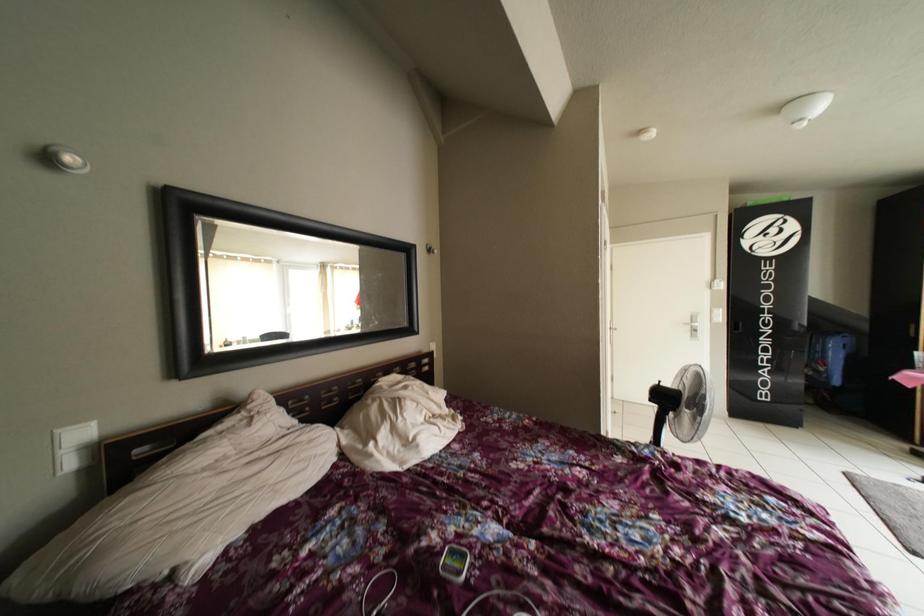
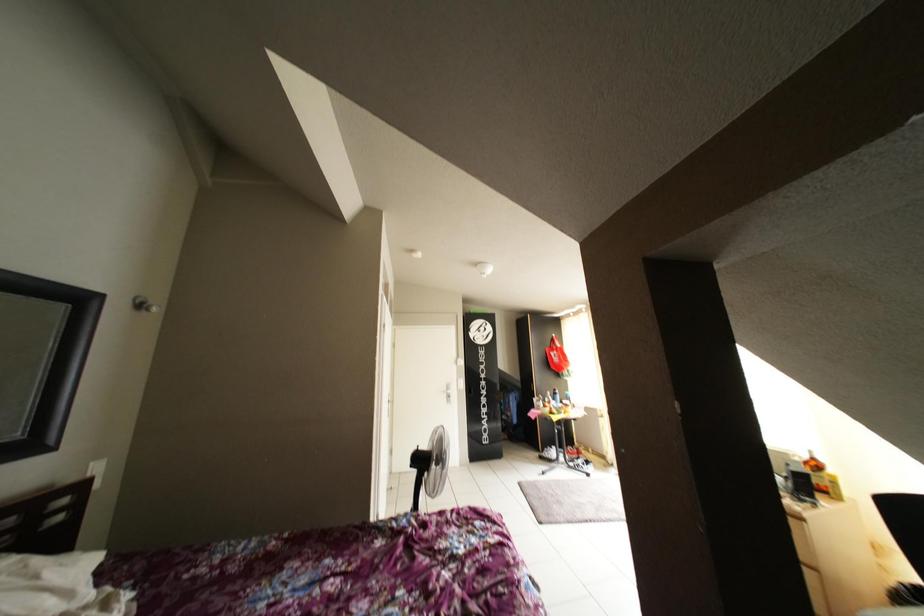
The images are taken continuously from a first-person perspective. In which direction is your viewpoint rotating?

The camera's rotation is toward right-up.